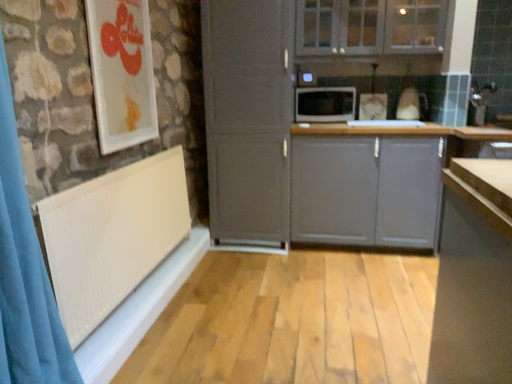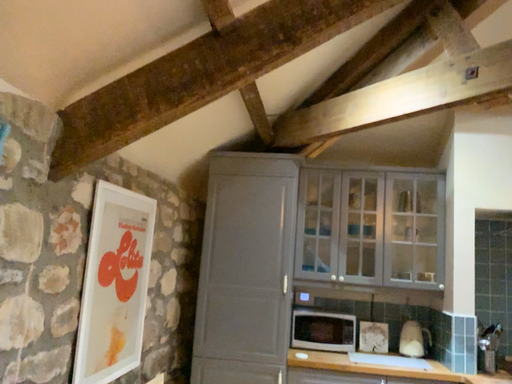
Question: Which way did the camera rotate in the video?

Choices:
 (A) rotated downward
 (B) rotated upward

Answer: (B)